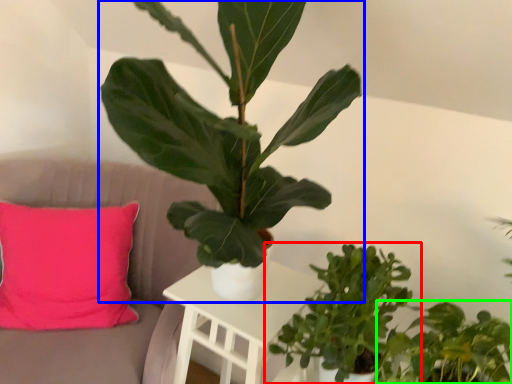
Question: Based on their relative distances, which object is farther from houseplant (highlighted by a red box)? Choose from houseplant (highlighted by a blue box) and houseplant (highlighted by a green box).

Choices:
 (A) houseplant
 (B) houseplant

Answer: (A)